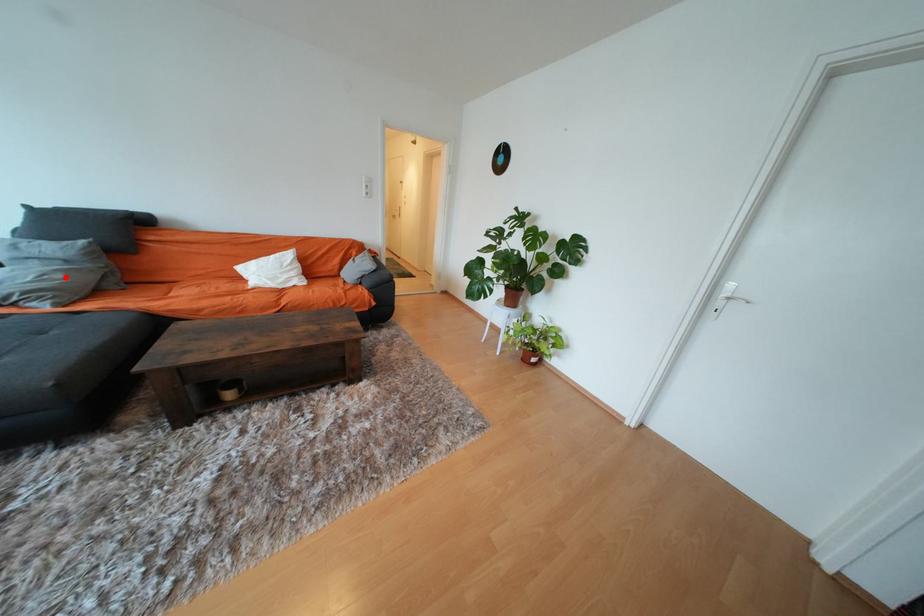
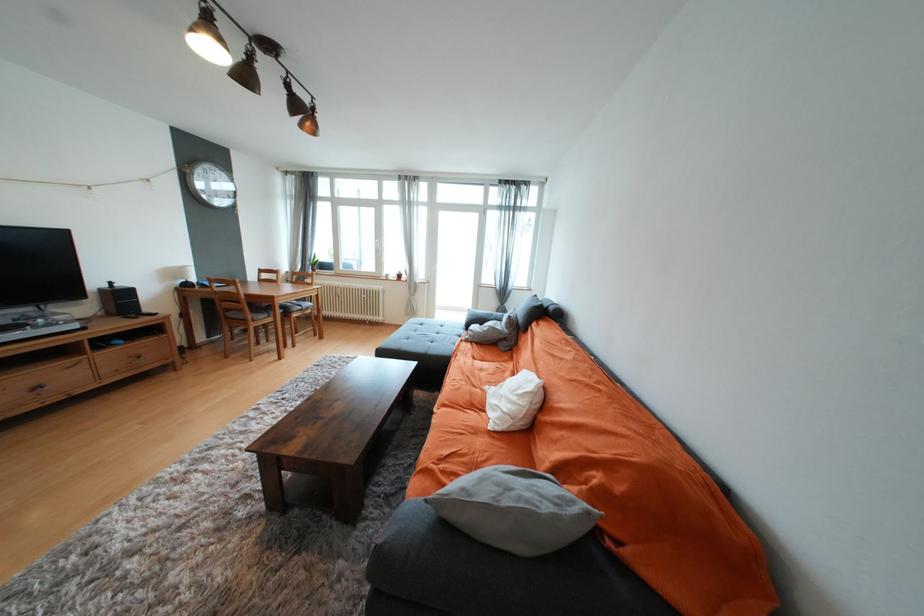
Locate, in the second image, the point that corresponds to the highlighted location in the first image.

(492, 330)